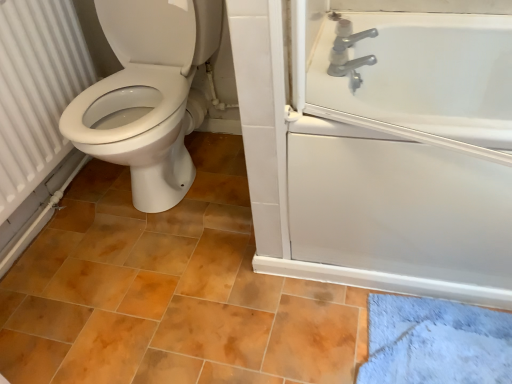
Question: Is white textured radiator at left not close to white glossy bathtub at upper right?

Choices:
 (A) no
 (B) yes

Answer: (B)

Question: Does white textured radiator at left have a lesser height compared to white glossy bathtub at upper right?

Choices:
 (A) no
 (B) yes

Answer: (A)

Question: Is white textured radiator at left turned away from white glossy bathtub at upper right?

Choices:
 (A) yes
 (B) no

Answer: (B)

Question: Does white textured radiator at left have a greater height compared to white glossy bathtub at upper right?

Choices:
 (A) no
 (B) yes

Answer: (B)

Question: Can you confirm if white textured radiator at left is thinner than white glossy bathtub at upper right?

Choices:
 (A) yes
 (B) no

Answer: (A)

Question: Is white textured radiator at left at the left side of white glossy bathtub at upper right?

Choices:
 (A) yes
 (B) no

Answer: (A)

Question: From the image's perspective, does white textured radiator at left appear higher than silver metallic faucet at upper right?

Choices:
 (A) yes
 (B) no

Answer: (B)

Question: Does white textured radiator at left have a smaller size compared to silver metallic faucet at upper right?

Choices:
 (A) no
 (B) yes

Answer: (A)

Question: Is white textured radiator at left to the left of silver metallic faucet at upper right from the viewer's perspective?

Choices:
 (A) no
 (B) yes

Answer: (B)

Question: Does white textured radiator at left have a lesser height compared to silver metallic faucet at upper right?

Choices:
 (A) no
 (B) yes

Answer: (A)

Question: Can you confirm if white textured radiator at left is taller than silver metallic faucet at upper right?

Choices:
 (A) yes
 (B) no

Answer: (A)

Question: Considering the relative sizes of white textured radiator at left and silver metallic faucet at upper right in the image provided, is white textured radiator at left bigger than silver metallic faucet at upper right?

Choices:
 (A) yes
 (B) no

Answer: (A)

Question: Does white glossy bathtub at upper right come in front of silver metallic faucet at upper right?

Choices:
 (A) no
 (B) yes

Answer: (B)